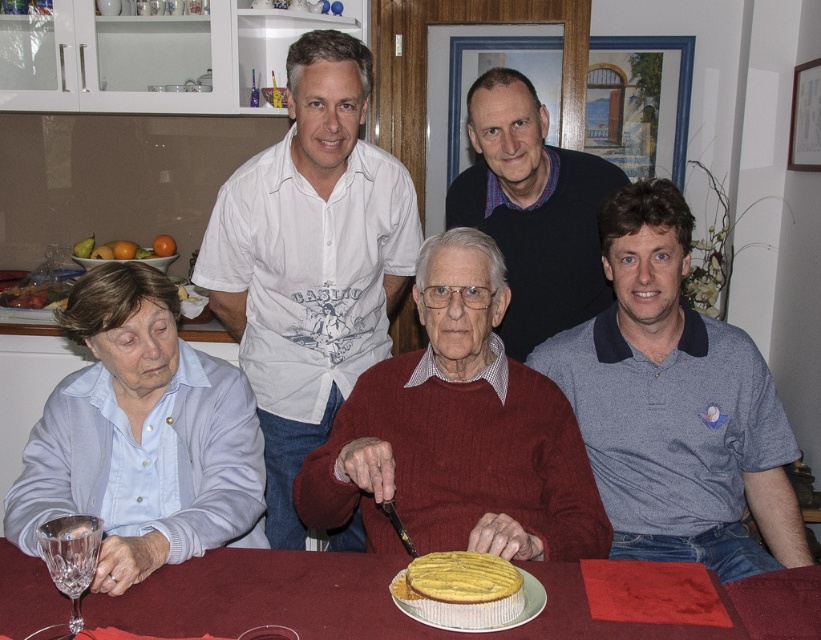
You are a guest at this gathering and want to place a small gift on the table. The gift is 10 cm tall. Considering the gray cotton polo shirt at right and the yellow sponge cake at center, which object is taller and can the gift be placed on top of it?

The gray cotton polo shirt at right is taller than the yellow sponge cake at center. The gift is 10 cm tall, so it can be placed on top of the gray cotton polo shirt at right since it is taller than the cake.

You are a server at a restaurant and need to place a 12 inch long platter on the table. Can you fit it between the smooth wooden table at center and the crystal clear wine glass at lower left?

The distance between the smooth wooden table at center and the crystal clear wine glass at lower left is 11.53 inches. Since the platter is 12 inches long, it won